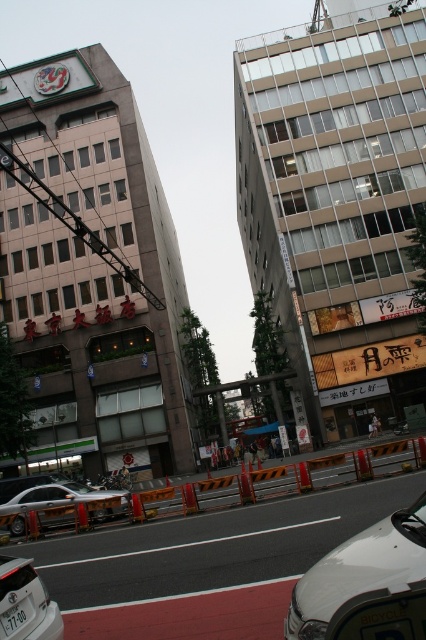
You are standing on the street looking up at the two buildings. There are two points marked on the buildings. One is at coordinate point (282, 490) and the other is at coordinate point (22, 618). From your perspective, which point is closer to you?

Point (22, 618) is closer to you because it is in front of point (282, 490) according to their spatial relationship.

You are a pedestrian standing on the sidewalk looking up at the two buildings. You notice a white glossy car at lower right and a silver metallic sedan at center. Which car is nearer to you?

The white glossy car at lower right is closer to the viewer than the silver metallic sedan at center.

You are a pedestrian standing on the street looking up at the two buildings. You notice an orange plastic barrier at center and a white plastic license plate at lower left. Which object is closer to you?

The orange plastic barrier at center is closer to you because it is further to the viewer than the white plastic license plate at lower left.